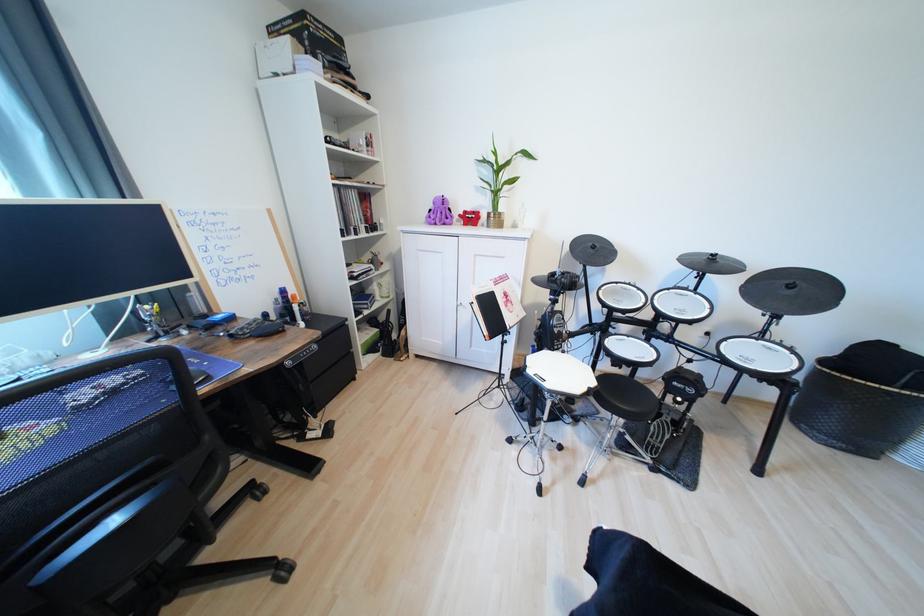
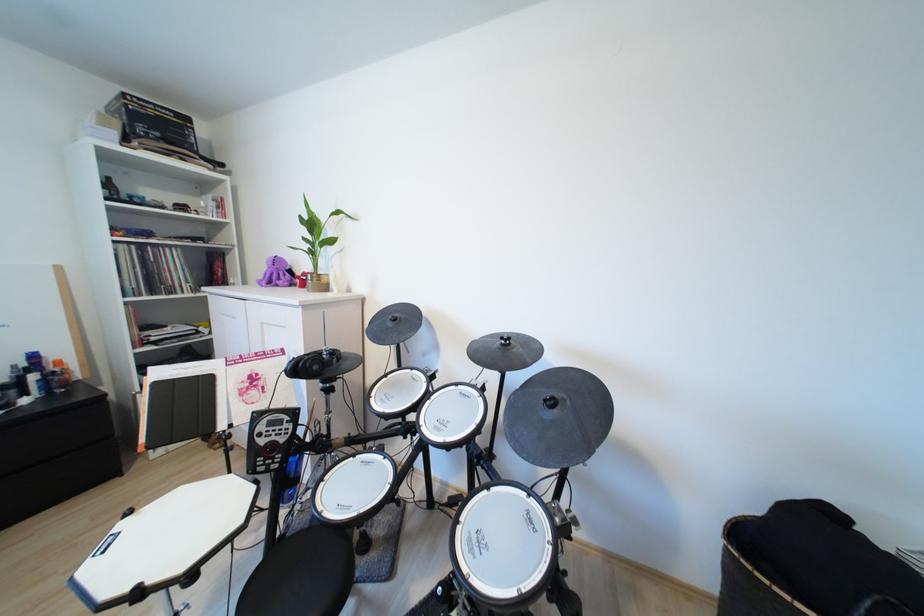
Locate, in the second image, the point that corresponds to (300,298) in the first image.

(66, 363)